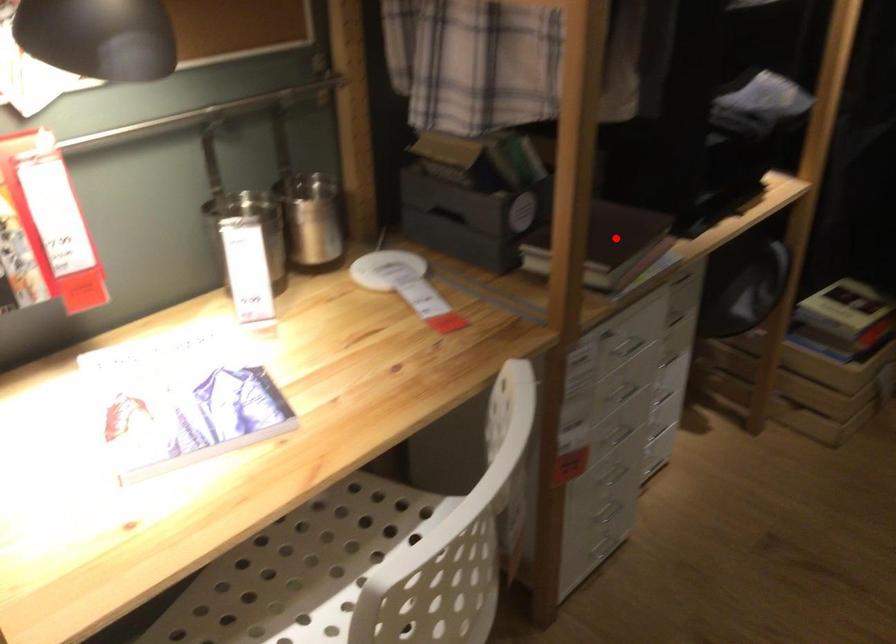
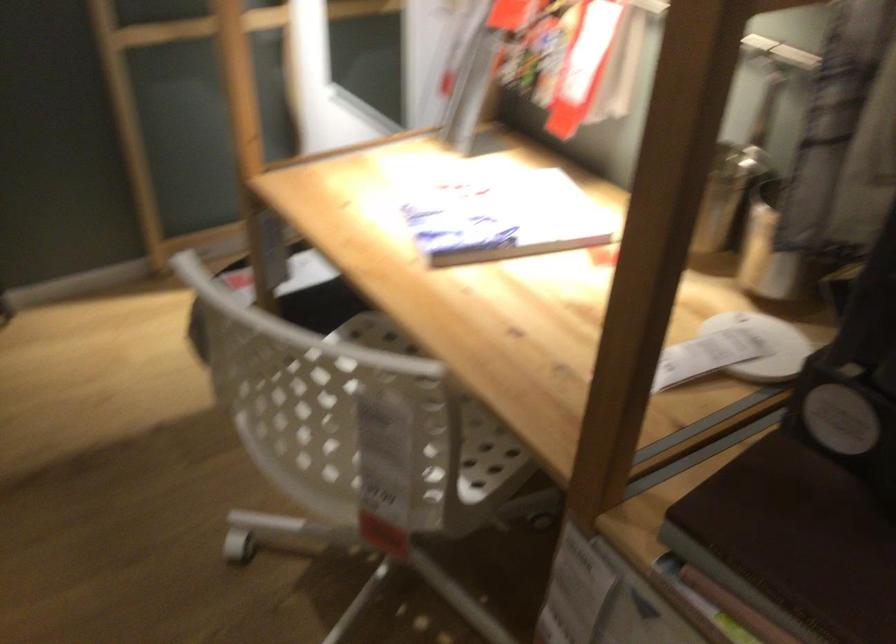
In the second image, find the point that corresponds to the highlighted location in the first image.

(793, 542)